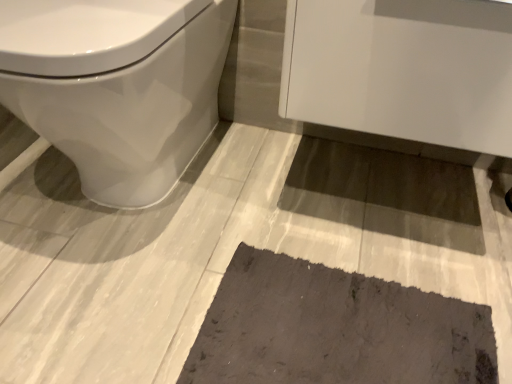
Locate an element on the screen. vacant location below dark gray textured bath mat at lower center (from a real-world perspective) is located at coordinates (337, 328).